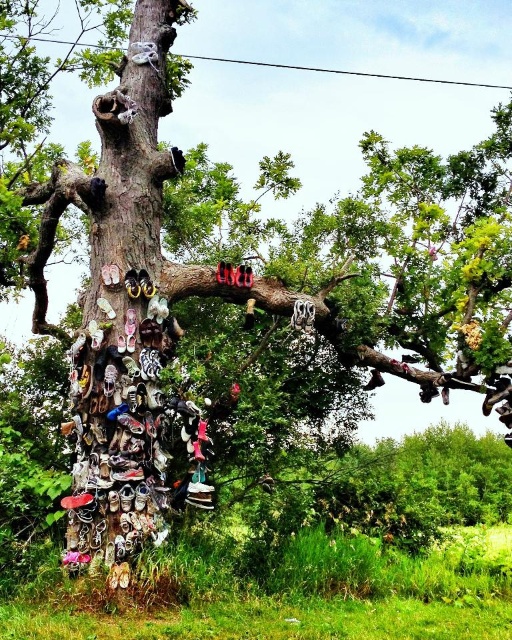
Is point (118, 470) farther from viewer compared to point (376, 371)?

No, it is in front of (376, 371).

From the picture: Can you confirm if shiny black sandals at left is thinner than shiny black shoe at upper right?

No, shiny black sandals at left is not thinner than shiny black shoe at upper right.

Does point (97, 346) lie behind point (380, 376)?

No, it is not.

Identify the location of shiny black sandals at left. (126, 428).